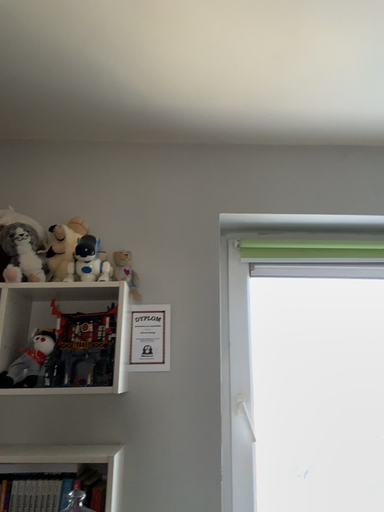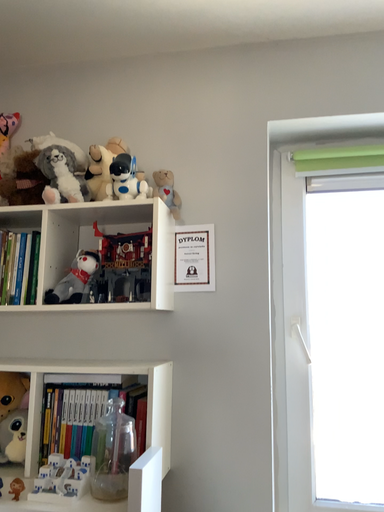
Question: Which way did the camera rotate in the video?

Choices:
 (A) rotated left
 (B) rotated right

Answer: (A)